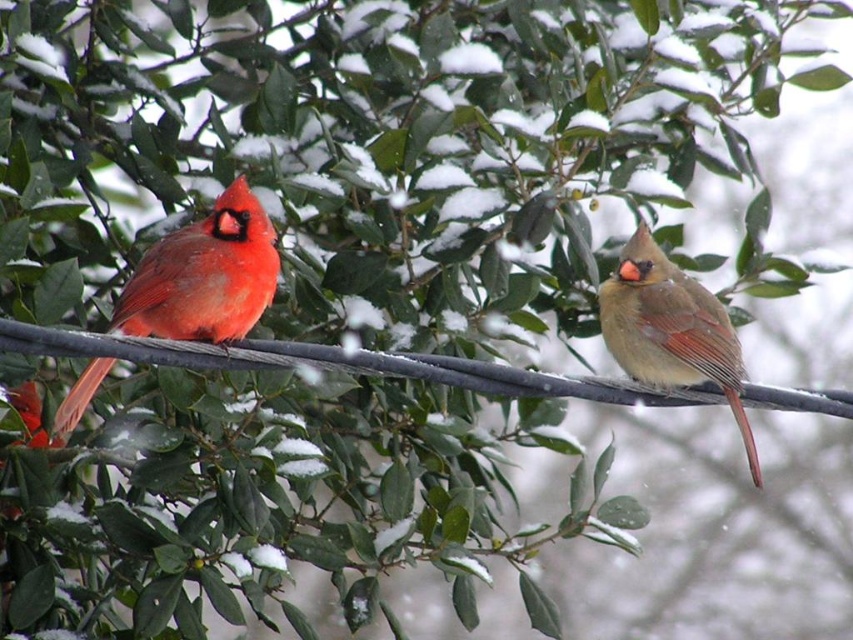
Question: Is matte red cardinal at left to the left of matte brown bird at right from the viewer's perspective?

Choices:
 (A) no
 (B) yes

Answer: (B)

Question: Can you confirm if matte red cardinal at left is bigger than matte brown bird at right?

Choices:
 (A) no
 (B) yes

Answer: (B)

Question: Among these objects, which one is nearest to the camera?

Choices:
 (A) matte red cardinal at left
 (B) matte brown bird at right

Answer: (A)

Question: Does matte red cardinal at left lie in front of matte brown bird at right?

Choices:
 (A) yes
 (B) no

Answer: (A)

Question: Among these objects, which one is farthest from the camera?

Choices:
 (A) matte red cardinal at left
 (B) matte brown bird at right

Answer: (B)

Question: Which point appears farthest from the camera in this image?

Choices:
 (A) (605, 300)
 (B) (195, 310)

Answer: (A)